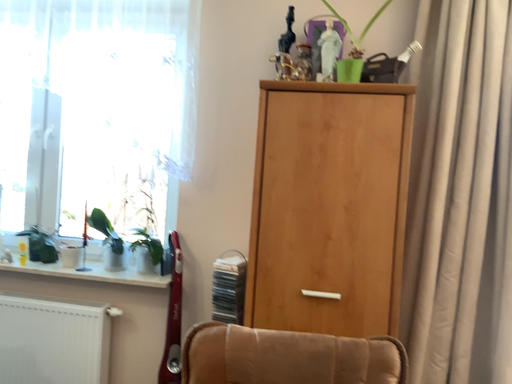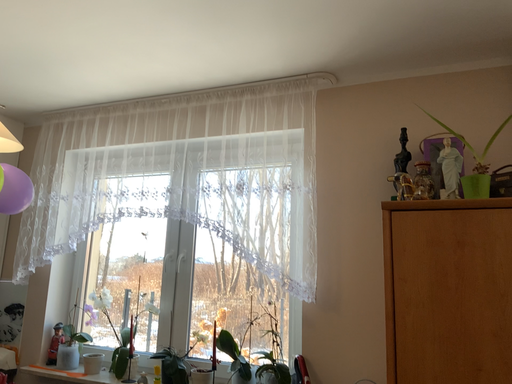
Question: How did the camera likely rotate when shooting the video?

Choices:
 (A) rotated downward
 (B) rotated upward

Answer: (B)